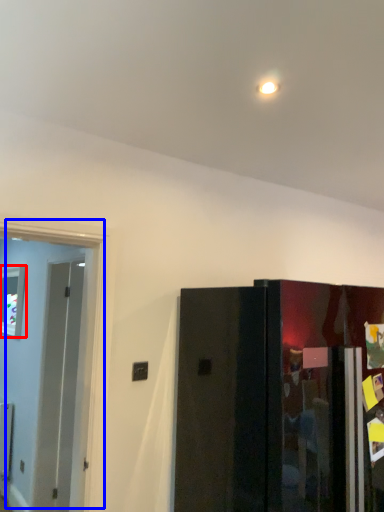
Question: Which point is closer to the camera, window (highlighted by a red box) or door (highlighted by a blue box)?

Choices:
 (A) window
 (B) door

Answer: (B)